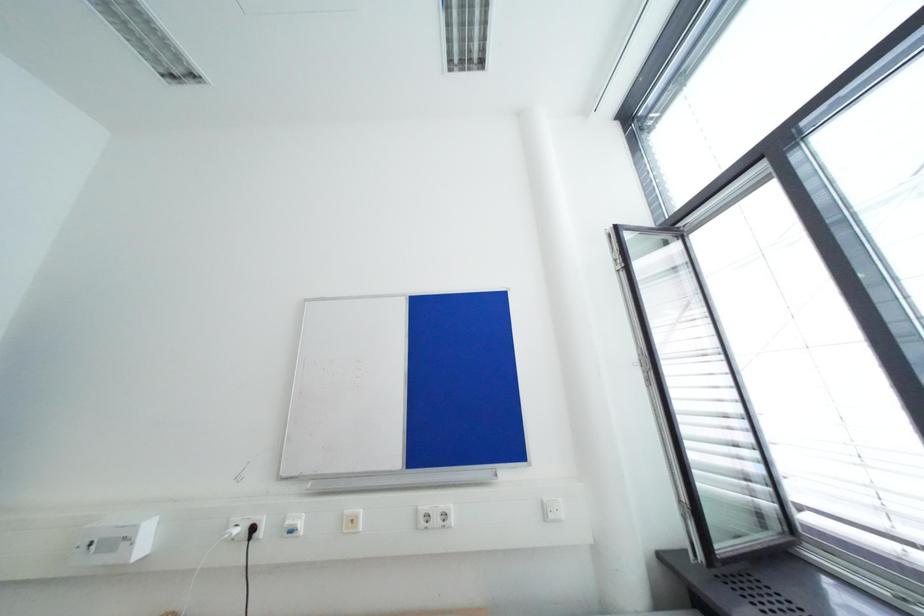
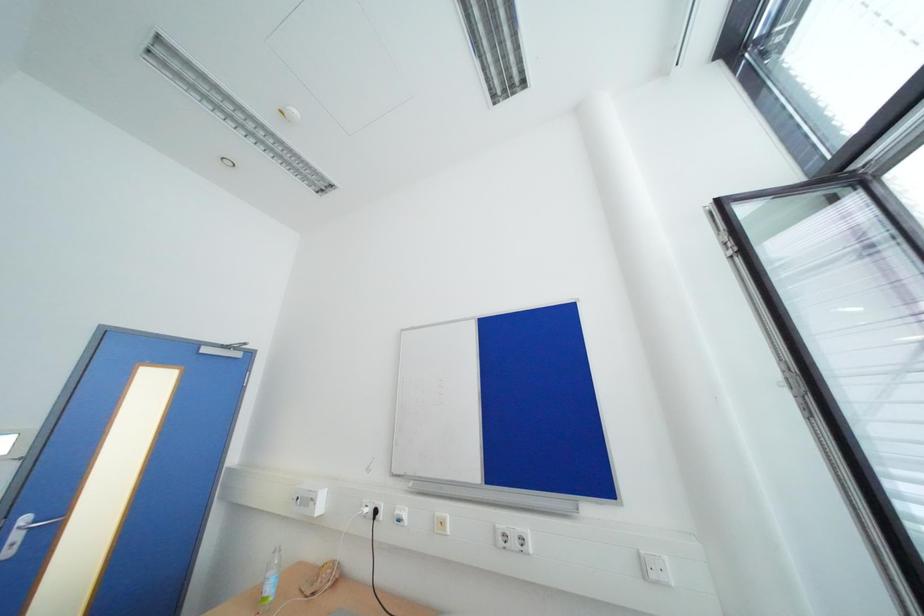
Question: The camera is either moving clockwise (left) or counter-clockwise (right) around the object. The first image is from the beginning of the video and the second image is from the end. Is the camera moving left or right when shooting the video?

Choices:
 (A) Left
 (B) Right

Answer: (B)